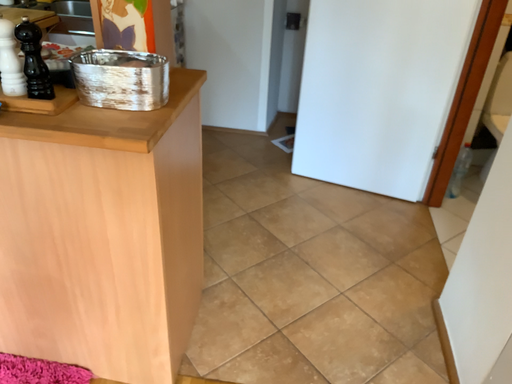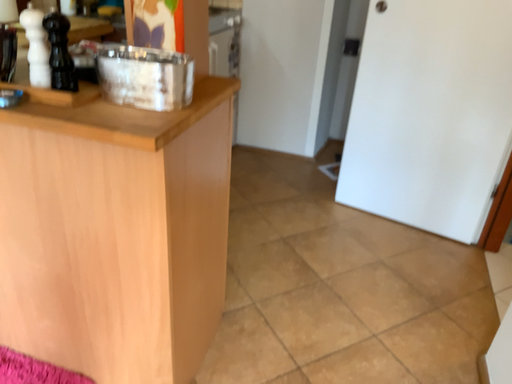
Question: Which way did the camera rotate in the video?

Choices:
 (A) rotated right
 (B) rotated left

Answer: (B)